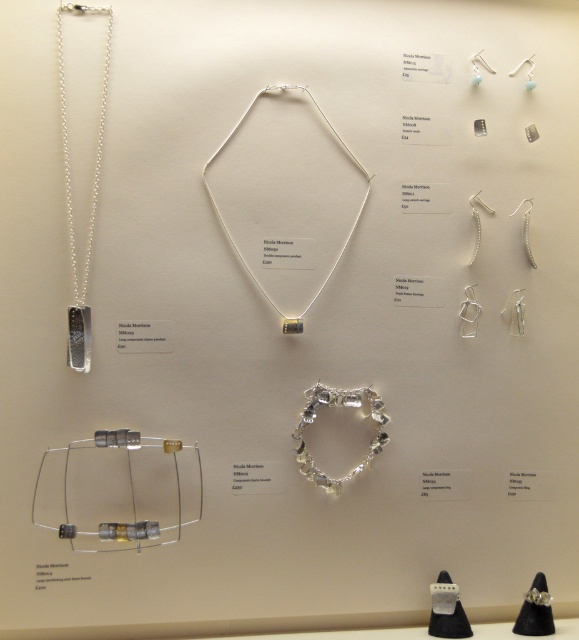
Question: Is the position of silver/metallic necklace at center less distant than that of silver/glass wire bracelet at lower left?

Choices:
 (A) no
 (B) yes

Answer: (A)

Question: Which of the following is the farthest from the observer?

Choices:
 (A) (361, 396)
 (B) (91, 13)
 (C) (250, 112)

Answer: (A)

Question: Does silver/metallic necklace at center have a greater width compared to silver/glass wire bracelet at lower left?

Choices:
 (A) no
 (B) yes

Answer: (B)

Question: Is silver/glass wire bracelet at lower left thinner than silver metallic chain pendant at left?

Choices:
 (A) yes
 (B) no

Answer: (B)

Question: Among these objects, which one is farthest from the camera?

Choices:
 (A) silver/metallic necklace at center
 (B) silver/glass wire bracelet at lower left
 (C) silver metallic chain pendant at left

Answer: (A)

Question: Which of these objects is positioned closest to the clear glass bracelet at center?

Choices:
 (A) silver/metallic necklace at center
 (B) silver/glass wire bracelet at lower left
 (C) silver metallic chain pendant at left

Answer: (B)